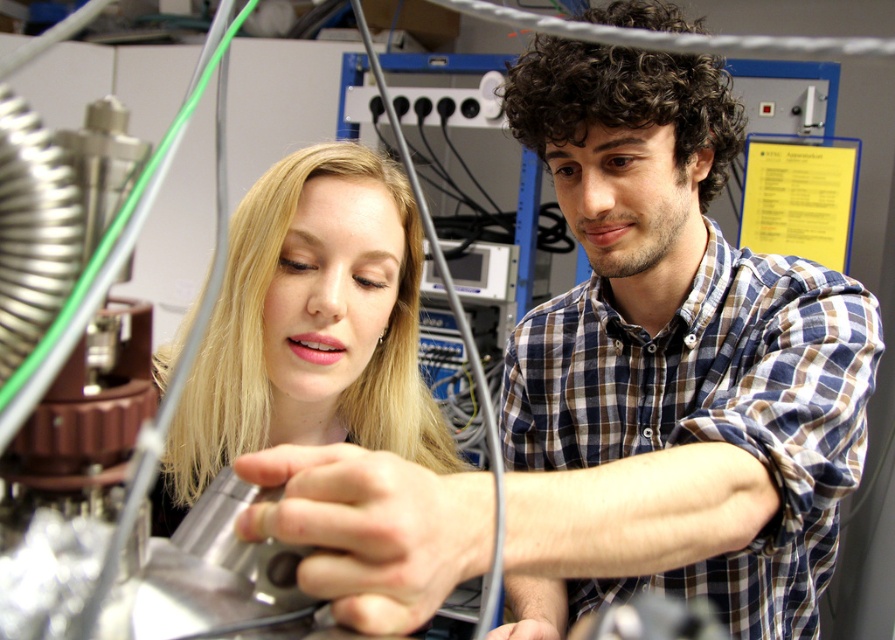
Where is the blue checkered shirt at center located in the image?

The blue checkered shirt at center is located at point (680,337).

You are a technician in the lab and need to adjust a component. You see two points marked in the image. Which point is closer to you, point at coordinates (x=810, y=356) or point at coordinates (x=226, y=403)?

Point at coordinates (x=810, y=356) is closer to you than point at coordinates (x=226, y=403).

You are standing at point [851,324] and want to take a photo of the camera. Can you take the photo without moving? Explain why or why not.

The point [851,324] and the camera are 31.94 inches apart. Since you are at the point and the camera is 31.94 inches away, you can take the photo without moving as long as your camera has a sufficient zoom or the subject is within your camera range.